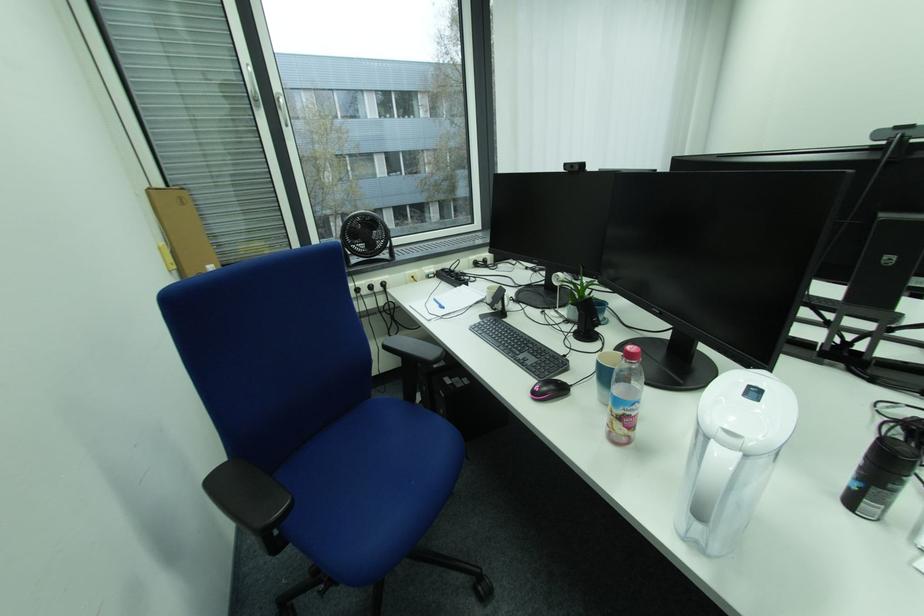
Where would you grip the black chair armrest? Please return your answer as a coordinate pair (x, y).

(248, 495)